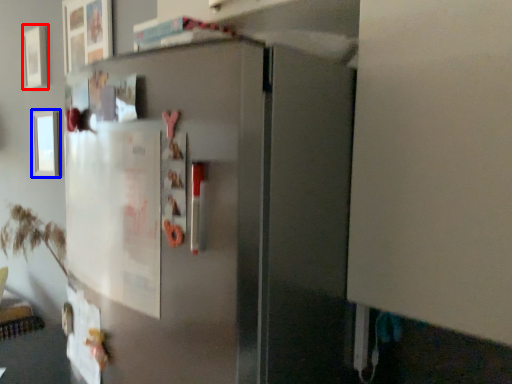
Question: Which point is closer to the camera, picture frame (highlighted by a red box) or picture frame (highlighted by a blue box)?

Choices:
 (A) picture frame
 (B) picture frame

Answer: (B)